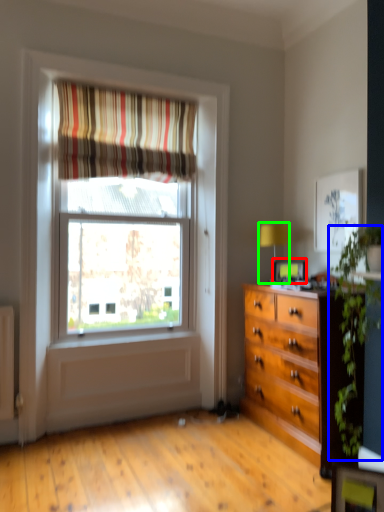
Question: Based on their relative distances, which object is nearer to picture frame (highlighted by a red box)? Choose from plant (highlighted by a blue box) and table lamp (highlighted by a green box).

Choices:
 (A) plant
 (B) table lamp

Answer: (B)